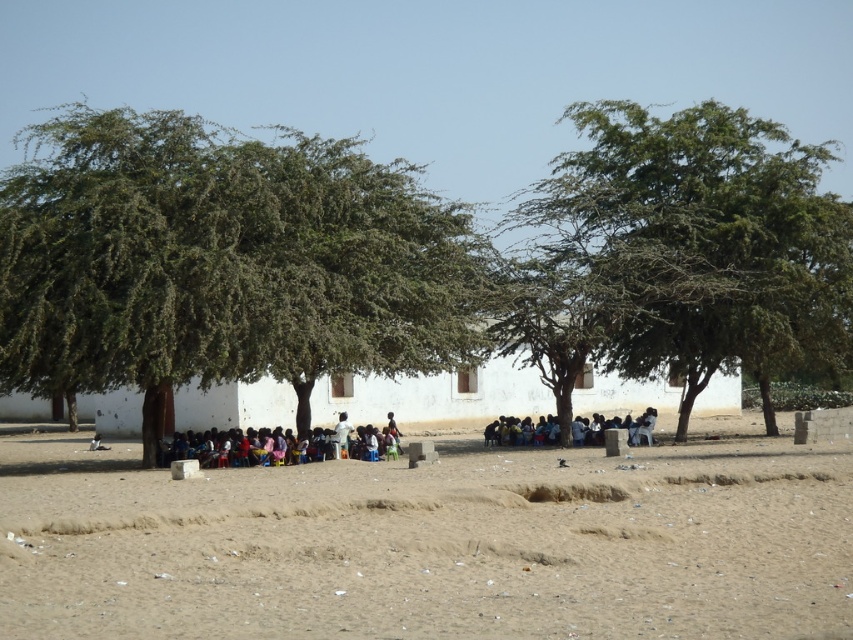
Is multicolored clothing at center positioned at the back of dark blue fabric at center?

That is False.

Does multicolored clothing at center have a lesser width compared to dark blue fabric at center?

No.

Is point (345, 417) closer to viewer compared to point (583, 442)?

That is True.

The image size is (853, 640). Identify the location of multicolored clothing at center. pos(380,442).

Does point (457, 532) lie behind point (49, 362)?

That is False.

Is brown sandy dirt field at center to the left of green leafy tree at left from the viewer's perspective?

In fact, brown sandy dirt field at center is to the right of green leafy tree at left.

Who is more distant from viewer, (512,618) or (184,186)?

The point (184,186) is more distant.

At what (x,y) coordinates should I click in order to perform the action: click on brown sandy dirt field at center. Please return your answer as a coordinate pair (x, y). This screenshot has height=640, width=853. Looking at the image, I should click on (432, 545).

Consider the image. Can you confirm if brown sandy dirt field at center is smaller than white matte building at center?

Indeed, brown sandy dirt field at center has a smaller size compared to white matte building at center.

Where is `brown sandy dirt field at center`? Image resolution: width=853 pixels, height=640 pixels. brown sandy dirt field at center is located at coordinates click(x=432, y=545).

At what (x,y) coordinates should I click in order to perform the action: click on brown sandy dirt field at center. Please return your answer as a coordinate pair (x, y). This screenshot has width=853, height=640. Looking at the image, I should click on (432, 545).